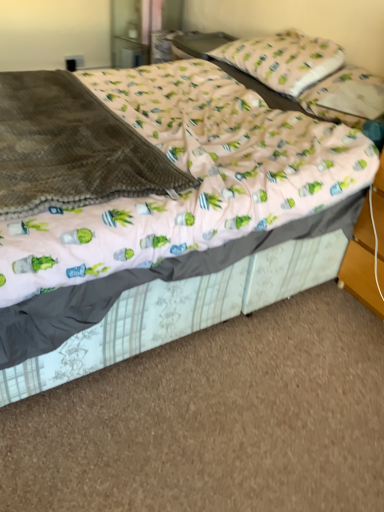
Question: From a real-world perspective, is brown fleece blanket at left physically located above or below pink fabric pillow at upper right, the 2th pillow when ordered from top to bottom?

Choices:
 (A) below
 (B) above

Answer: (A)

Question: Based on their sizes in the image, would you say brown fleece blanket at left is bigger or smaller than pink fabric pillow at upper right, the 2th pillow when ordered from top to bottom?

Choices:
 (A) big
 (B) small

Answer: (A)

Question: Which object is the farthest from the brown fleece blanket at left?

Choices:
 (A) pink fabric pillow at upper center, the 2th pillow from the bottom
 (B) pink fabric pillow at upper right, the 2th pillow when ordered from top to bottom
 (C) pink fabric bed at center

Answer: (A)

Question: Which object is the farthest from the brown fleece blanket at left?

Choices:
 (A) pink fabric pillow at upper right, the 2th pillow when ordered from top to bottom
 (B) pink fabric bed at center
 (C) pink fabric pillow at upper center, which is counted as the first pillow, starting from the top

Answer: (C)